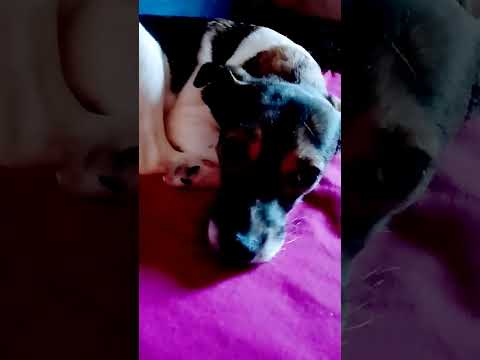
This screenshot has height=360, width=480. In order to click on pink bedding in this screenshot , I will do `click(179, 324)`.